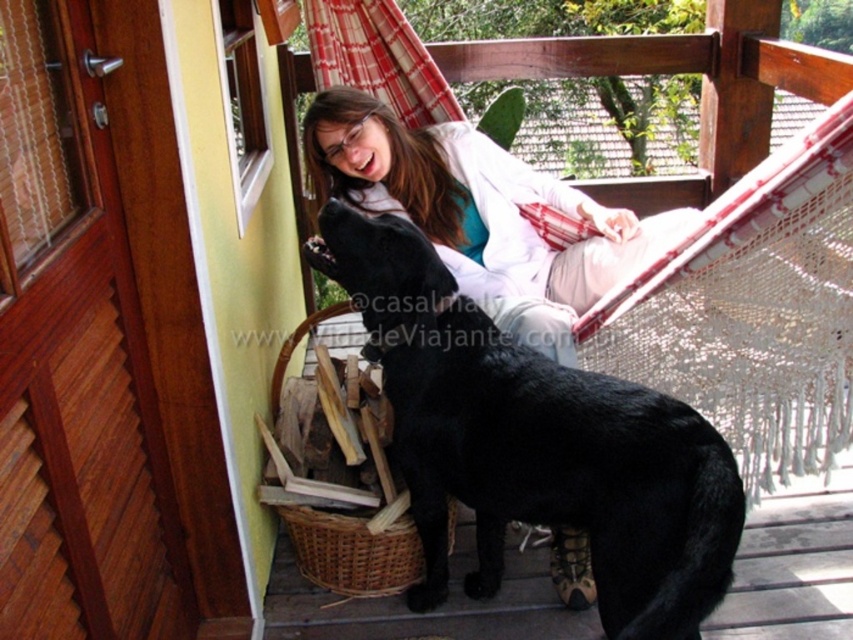
You are a painter standing on the porch and want to paint the black glossy fur at lower center and the matte white coat at upper center. Which object should you paint first if you want to start with the taller one?

The black glossy fur at lower center is taller than the matte white coat at upper center, so you should paint the black glossy fur at lower center first.